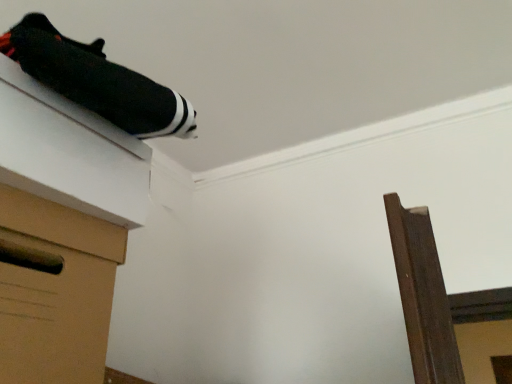
Question: Is brown cardboard drawer at lower left facing towards black fabric at upper left?

Choices:
 (A) yes
 (B) no

Answer: (B)

Question: Is brown cardboard drawer at lower left thinner than black fabric at upper left?

Choices:
 (A) no
 (B) yes

Answer: (A)

Question: From the image's perspective, is brown cardboard drawer at lower left located above black fabric at upper left?

Choices:
 (A) yes
 (B) no

Answer: (B)

Question: Is brown cardboard drawer at lower left to the left of black fabric at upper left from the viewer's perspective?

Choices:
 (A) no
 (B) yes

Answer: (B)

Question: Does brown cardboard drawer at lower left have a smaller size compared to black fabric at upper left?

Choices:
 (A) yes
 (B) no

Answer: (B)

Question: From the image's perspective, relative to brown cardboard drawer at lower left, is black fabric at upper left above or below?

Choices:
 (A) above
 (B) below

Answer: (A)

Question: Is black fabric at upper left inside the boundaries of brown cardboard drawer at lower left, or outside?

Choices:
 (A) inside
 (B) outside

Answer: (B)

Question: Considering the relative positions of black fabric at upper left and brown cardboard drawer at lower left in the image provided, is black fabric at upper left to the left or to the right of brown cardboard drawer at lower left?

Choices:
 (A) left
 (B) right

Answer: (B)

Question: In the image, is black fabric at upper left positioned in front of or behind brown cardboard drawer at lower left?

Choices:
 (A) behind
 (B) front

Answer: (A)

Question: Is point (7, 364) closer or farther from the camera than point (56, 236)?

Choices:
 (A) closer
 (B) farther

Answer: (A)

Question: Is brown cardboard drawer at lower left spatially inside black fabric at upper left, or outside of it?

Choices:
 (A) inside
 (B) outside

Answer: (B)

Question: Is brown cardboard drawer at lower left wider or thinner than black fabric at upper left?

Choices:
 (A) wide
 (B) thin

Answer: (A)

Question: Considering the positions of brown cardboard drawer at lower left and black fabric at upper left in the image, is brown cardboard drawer at lower left taller or shorter than black fabric at upper left?

Choices:
 (A) short
 (B) tall

Answer: (B)

Question: Is point (146, 97) closer or farther from the camera than point (59, 112)?

Choices:
 (A) closer
 (B) farther

Answer: (B)

Question: Would you say black fabric shoe at upper left is to the left or to the right of black fabric at upper left in the picture?

Choices:
 (A) left
 (B) right

Answer: (B)